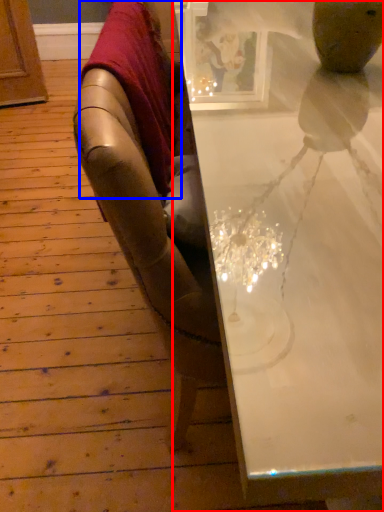
Question: Which of the following is the farthest to the observer, table (highlighted by a red box) or blanket (highlighted by a blue box)?

Choices:
 (A) table
 (B) blanket

Answer: (B)